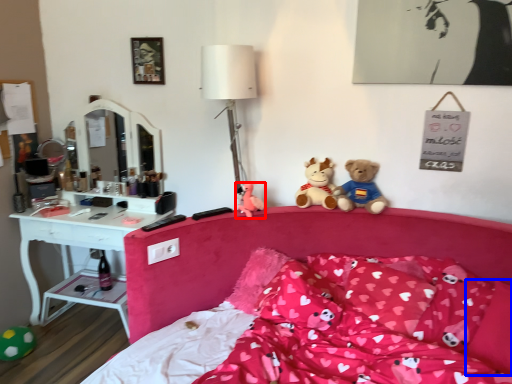
Question: Which object appears farthest to the camera in this image, toy (highlighted by a red box) or pillow (highlighted by a blue box)?

Choices:
 (A) toy
 (B) pillow

Answer: (A)